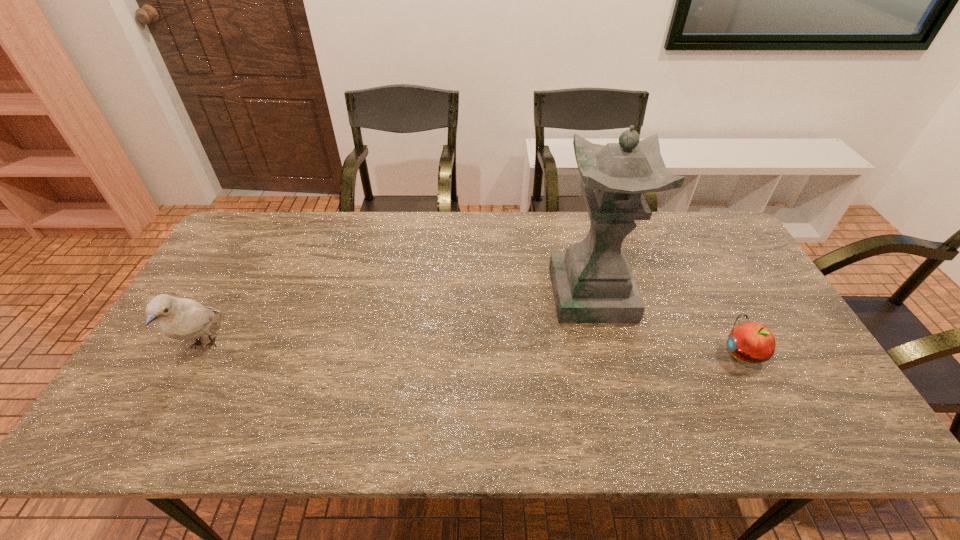
This screenshot has width=960, height=540. What are the coordinates of `sculpture` in the screenshot? It's located at (592, 282).

Where is `the second object from right to left`? the second object from right to left is located at coordinates (592, 282).

Where is `the leftmost object`? the leftmost object is located at coordinates (178, 318).

Locate an element on the screen. The image size is (960, 540). the second tallest object is located at coordinates (178, 318).

Identify the location of the shortest object. (751, 342).

Locate an element on the screen. This screenshot has height=540, width=960. the rightmost object is located at coordinates (751, 342).

You are a GUI agent. You are given a task and a screenshot of the screen. Output one action in this format:
    pyautogui.click(x=<x>, y=<y>)
    Task: Click on the free space located at the front opening of the second object from right to left
    This screenshot has height=540, width=960.
    Given the screenshot: What is the action you would take?
    pyautogui.click(x=435, y=294)

Locate an element on the screen. free spot located at the front opening of the second object from right to left is located at coordinates (522, 294).

This screenshot has width=960, height=540. What are the coordinates of `free point located at the front opening of the second object from right to left` in the screenshot? It's located at (471, 294).

I want to click on free space located 0.160m at the beak of the leftmost object, so click(153, 439).